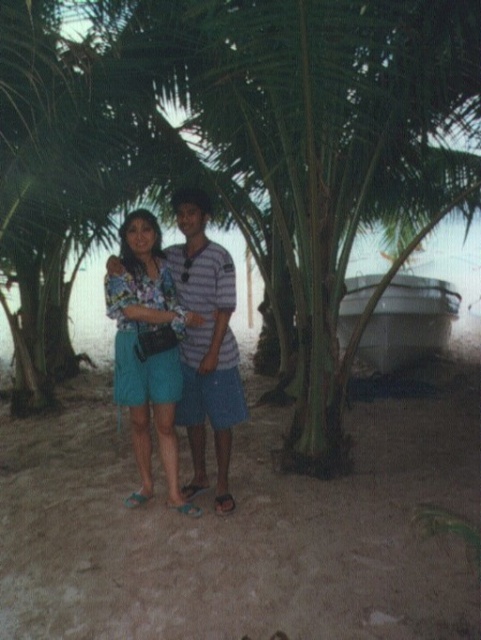
You are a photographer trying to capture the perfect shot of the matte floral blouse at center. Based on the coordinates provided, where should you position your camera to ensure the blouse is centered in the frame?

The matte floral blouse at center is already positioned at the coordinates point (147, 348), so you should center your camera at that point to capture it perfectly.

You are a photographer trying to capture a photo of both the matte floral blouse at center and the striped shirt at center. Since you want to ensure both are fully visible in the frame, which one should you focus on first to avoid cropping the shorter one?

The matte floral blouse at center is shorter than the striped shirt at center. To avoid cropping the shorter one, you should focus on the matte floral blouse at center first, ensuring it is fully visible before adjusting the frame to include the taller striped shirt at center.